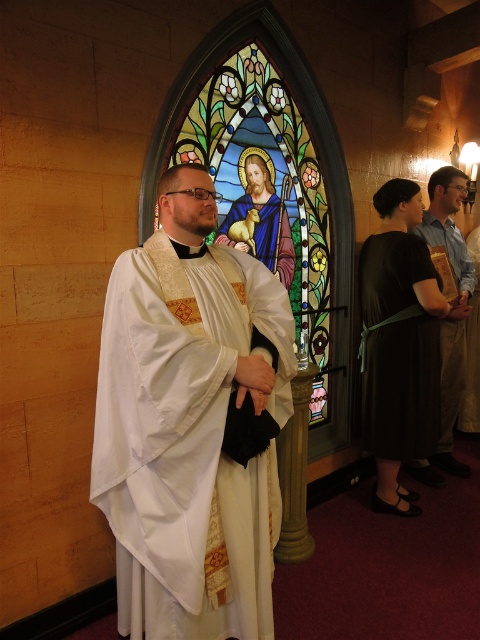
You are a photographer standing in the church and want to capture a clear photo of both the white satin robe at center and the matte white robe at center. Which robe will appear larger in the photo?

The white satin robe at center will appear larger in the photo because it is closer to the viewer than the matte white robe at center.

Based on the scene description, which object is positioned lower between the white satin robe at center and the matte white robe at center?

The white satin robe at center is located below the matte white robe at center, so it is positioned lower.

You are standing in a church and want to place a small candle on the floor at the exact location of the point marked at coordinates point (x=384, y=236). If the candle is 1 foot tall, will it be visible from your current position?

The point marked at coordinates point (x=384, y=236) is 9.49 feet away from you. Since the candle is only 1 foot tall, it may not be clearly visible from that distance due to its small size, but its presence could still be discernible depending on lighting conditions.